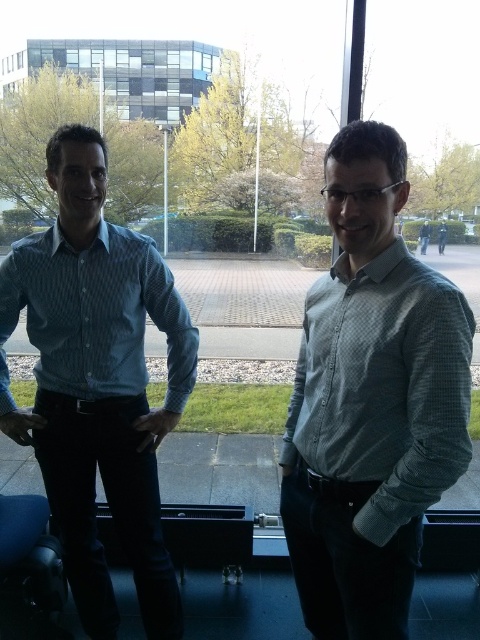
Who is lower down, light blue checkered shirt at center or blue checkered shirt at left?

light blue checkered shirt at center is lower down.

Where is `light blue checkered shirt at center`? This screenshot has width=480, height=640. light blue checkered shirt at center is located at coordinates (371, 401).